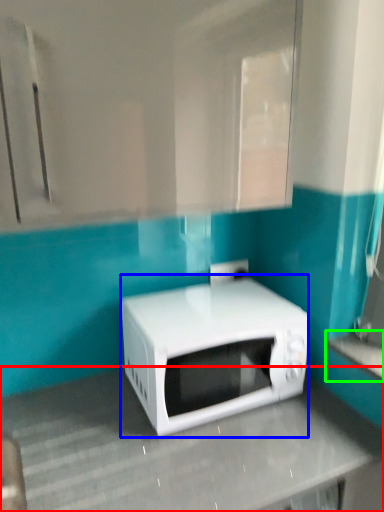
Question: Which is farther away from counter top (highlighted by a red box)? microwave oven (highlighted by a blue box) or counter top (highlighted by a green box)?

Choices:
 (A) microwave oven
 (B) counter top

Answer: (B)